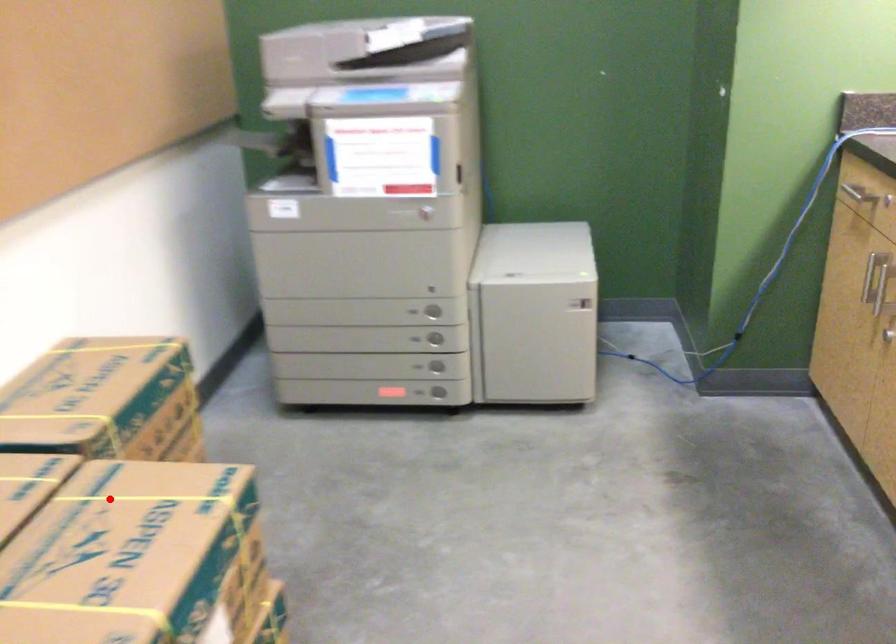
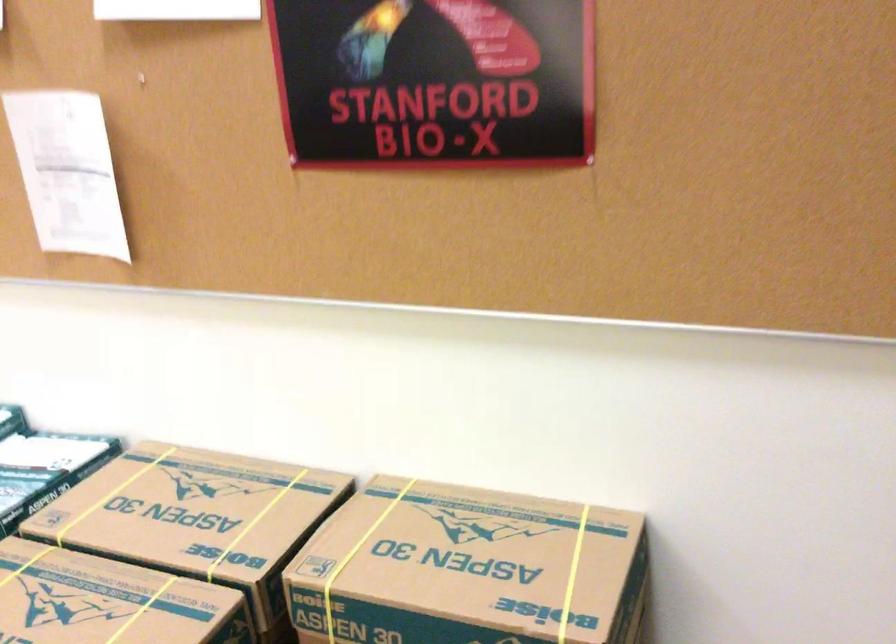
Question: I am providing you with two images of the same scene from different viewpoints. Image1 has a red point marked. In image2, the corresponding 3D location appears at what relative position? Reply with the corresponding letter.

Choices:
 (A) Closer
 (B) Farther

Answer: (A)